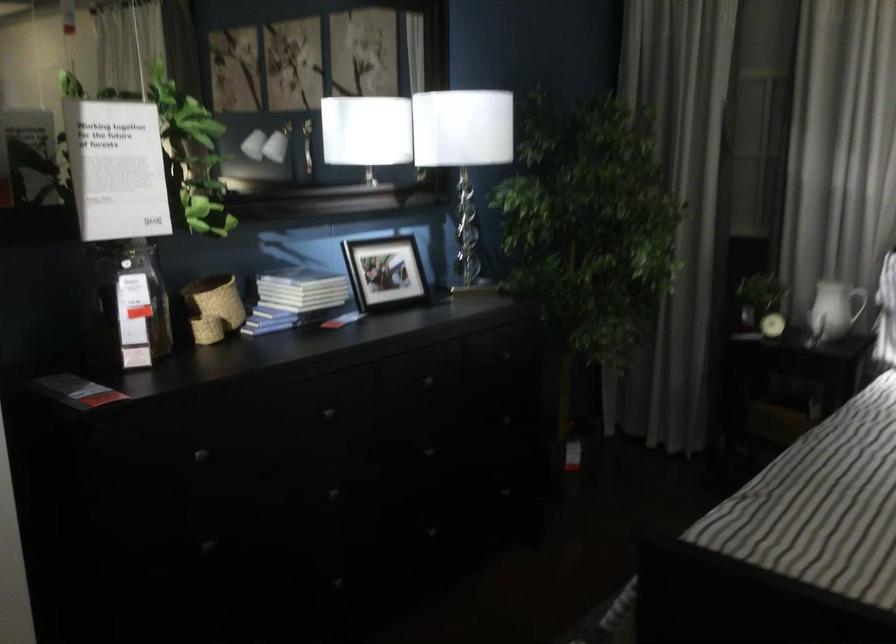
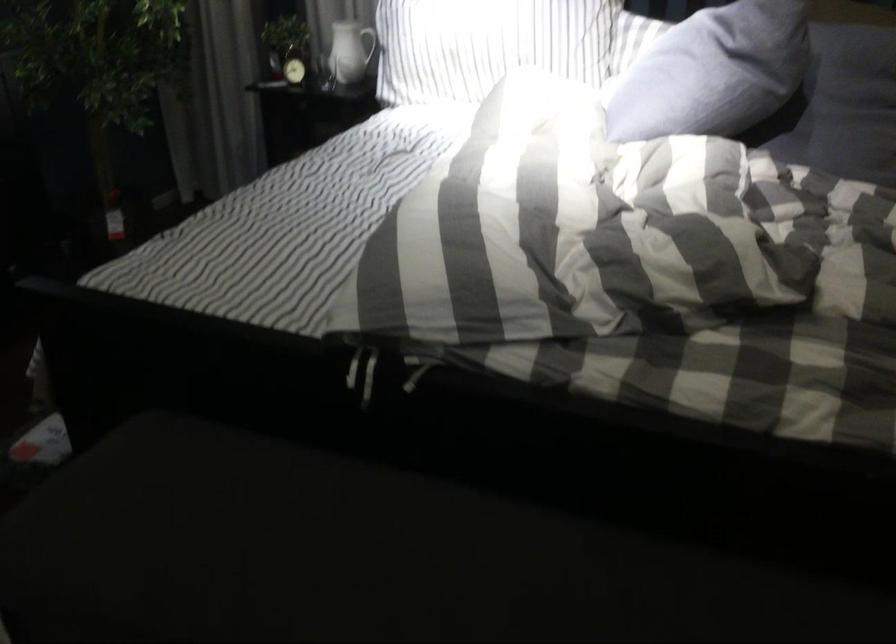
In a continuous first-person perspective shot, in which direction is the camera moving?

The movement direction of the cameraman is right, backward.